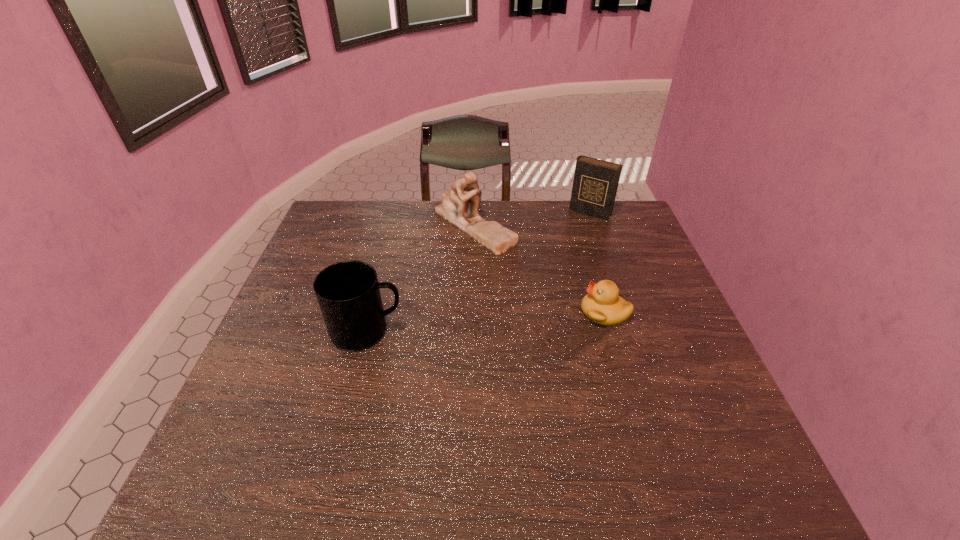
The height and width of the screenshot is (540, 960). Identify the location of vacant region located 0.240m on the front cover of the diary. (553, 258).

Identify the location of blank space located on the front-facing side of the third object from right to left. This screenshot has height=540, width=960. (465, 299).

Where is `free space located on the front-facing side of the third object from right to left`? Image resolution: width=960 pixels, height=540 pixels. free space located on the front-facing side of the third object from right to left is located at coordinates (462, 321).

Where is `vacant area situated 0.050m on the front-facing side of the third object from right to left`? The image size is (960, 540). vacant area situated 0.050m on the front-facing side of the third object from right to left is located at coordinates (469, 266).

This screenshot has height=540, width=960. Find the location of `diary present at the far edge`. diary present at the far edge is located at coordinates (595, 184).

At what (x,y) coordinates should I click in order to perform the action: click on figurine situated at the far edge. Please return your answer as a coordinate pair (x, y). The height and width of the screenshot is (540, 960). Looking at the image, I should click on (455, 208).

Locate an element on the screen. Image resolution: width=960 pixels, height=540 pixels. object at the left edge is located at coordinates click(348, 292).

At what (x,y) coordinates should I click in order to perform the action: click on duckling that is at the right edge. Please return your answer as a coordinate pair (x, y). This screenshot has width=960, height=540. Looking at the image, I should click on [602, 304].

Where is `diary at the right edge`? diary at the right edge is located at coordinates (595, 184).

Locate an element on the screen. Image resolution: width=960 pixels, height=540 pixels. object at the far right corner is located at coordinates (595, 184).